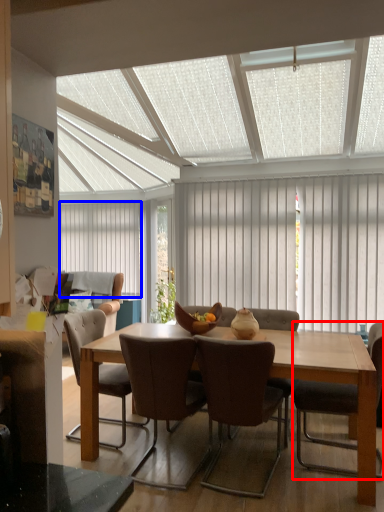
Question: Which object appears closest to the camera in this image, chair (highlighted by a red box) or curtain (highlighted by a blue box)?

Choices:
 (A) chair
 (B) curtain

Answer: (A)